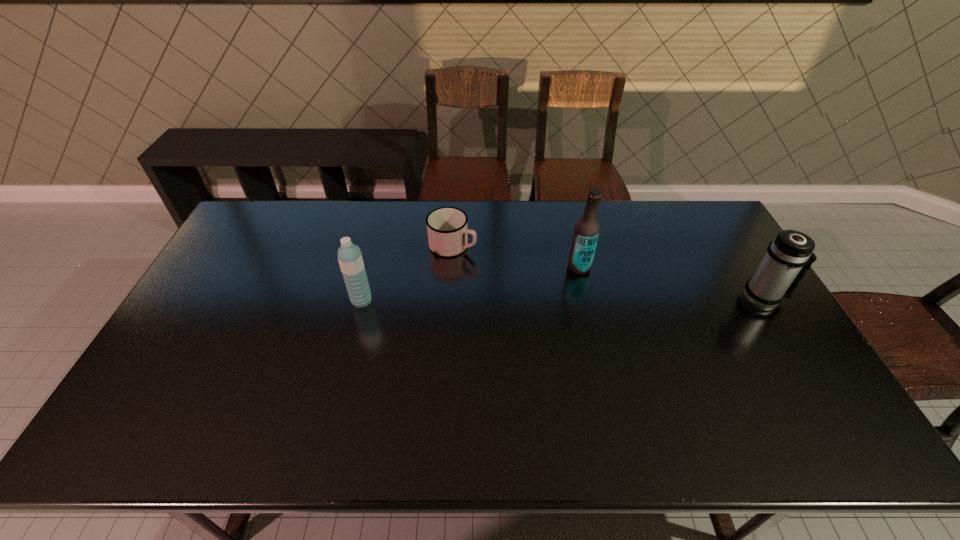
Choose which object is the third nearest neighbor to the mug. Please provide its 2D coordinates. Your answer should be formatted as a tuple, i.e. [(x, y)], where the tuple contains the x and y coordinates of a point satisfying the conditions above.

[(775, 278)]

You are a GUI agent. You are given a task and a screenshot of the screen. Output one action in this format:
    pyautogui.click(x=<x>, y=<y>)
    Task: Click on the free spot that satisfies the following two spatial constraints: 1. on the front side of the farthest object; 2. on the side with the handle of the rightmost object
    The image size is (960, 540).
    Given the screenshot: What is the action you would take?
    pyautogui.click(x=449, y=299)

Locate an element on the screen. This screenshot has width=960, height=540. free space that satisfies the following two spatial constraints: 1. on the back side of the leftmost object; 2. on the side with the handle of the rightmost object is located at coordinates (362, 299).

The image size is (960, 540). What are the coordinates of `vacant space that satisfies the following two spatial constraints: 1. on the front side of the third object from left to right; 2. on the side with the handle of the rightmost object` in the screenshot? It's located at (587, 299).

The height and width of the screenshot is (540, 960). In order to click on free space that satisfies the following two spatial constraints: 1. on the front side of the rightmost object; 2. on the side with the handle of the mug in this screenshot , I will do `click(449, 299)`.